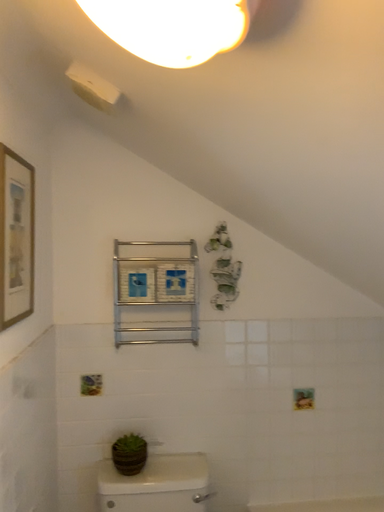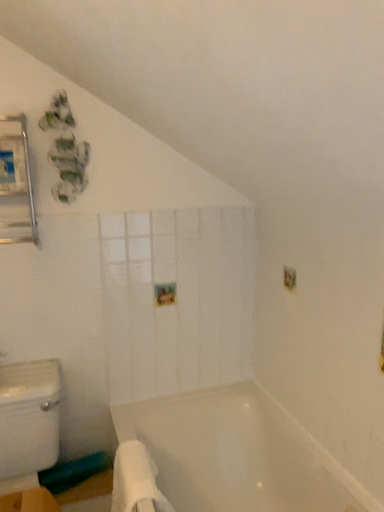
Question: Which way did the camera rotate in the video?

Choices:
 (A) rotated left
 (B) rotated right

Answer: (B)